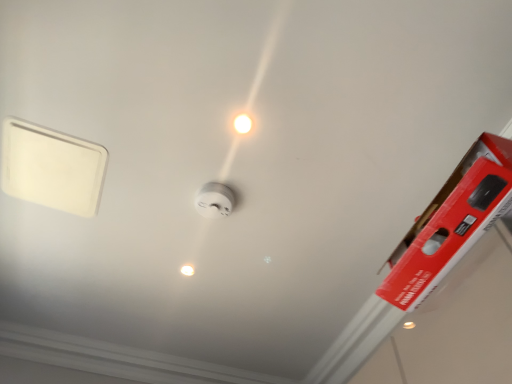
In order to face white glossy light bulb at center, acting as the first light bulb starting from the front, should I rotate leftwards or rightwards?

It's best to rotate left around 1.644 degrees.

Measure the distance between point (219, 196) and camera.

The distance of point (219, 196) from camera is 1.53 meters.

You are a GUI agent. You are given a task and a screenshot of the screen. Output one action in this format:
    pyautogui.click(x=<x>, y=<y>)
    Task: Click on the white glossy light bulb at center, which is the second light bulb from right to left
    This screenshot has width=512, height=384.
    Given the screenshot: What is the action you would take?
    pyautogui.click(x=187, y=270)

I want to click on white glossy light bulb at center, the first light bulb from the right, so click(242, 124).

From a real-world perspective, is white glossy light bulb at center, the first light bulb from the right, located higher than white plastic smoke detector at center?

Yes, from a real-world perspective, white glossy light bulb at center, the first light bulb from the right, is on top of white plastic smoke detector at center.

Is white glossy light bulb at center, marked as the second light bulb in a bottom-to-top arrangement, positioned with its back to white plastic smoke detector at center?

Yes, white glossy light bulb at center, marked as the second light bulb in a bottom-to-top arrangement, is positioned with its back facing white plastic smoke detector at center.

In the image, is white glossy light bulb at center, the second light bulb viewed from the back, positioned in front of or behind white plastic smoke detector at center?

white glossy light bulb at center, the second light bulb viewed from the back, is in front of white plastic smoke detector at center.

Based on the photo, between white glossy light bulb at center, marked as the second light bulb in a bottom-to-top arrangement, and white plastic smoke detector at center, which one has less height?

white glossy light bulb at center, marked as the second light bulb in a bottom-to-top arrangement, is shorter.

How many degrees apart are the facing directions of white glossy light bulb at center, acting as the second light bulb starting from the front, and white plastic smoke detector at center?

There is a 9.07-degree angle between the facing directions of white glossy light bulb at center, acting as the second light bulb starting from the front, and white plastic smoke detector at center.

From a real-world perspective, is white glossy light bulb at center, which is counted as the 1th light bulb, starting from the bottom, physically located above or below white plastic smoke detector at center?

From a real-world perspective, white glossy light bulb at center, which is counted as the 1th light bulb, starting from the bottom, is physically above white plastic smoke detector at center.

Is white glossy light bulb at center, which is the second light bulb from right to left, completely or partially outside of white plastic smoke detector at center?

That's correct, white glossy light bulb at center, which is the second light bulb from right to left, is outside of white plastic smoke detector at center.

Can you confirm if white glossy light bulb at center, placed as the first light bulb when sorted from left to right, is wider than white plastic smoke detector at center?

Incorrect, the width of white glossy light bulb at center, placed as the first light bulb when sorted from left to right, does not surpass that of white plastic smoke detector at center.

Which is behind, point (185, 268) or point (246, 119)?

The point (185, 268) is farther from the camera.

From a real-world perspective, is white glossy light bulb at center, acting as the second light bulb starting from the front, over white glossy light bulb at center, the second light bulb viewed from the back?

No, from a real-world perspective, white glossy light bulb at center, acting as the second light bulb starting from the front, is not over white glossy light bulb at center, the second light bulb viewed from the back

Is white glossy light bulb at center, acting as the second light bulb starting from the front, placed right next to white glossy light bulb at center, acting as the first light bulb starting from the front?

No, white glossy light bulb at center, acting as the second light bulb starting from the front, is not with white glossy light bulb at center, acting as the first light bulb starting from the front.

Where is `light bulb below the white glossy light bulb at center, the first light bulb from the right (from the image's perspective)`? The width and height of the screenshot is (512, 384). light bulb below the white glossy light bulb at center, the first light bulb from the right (from the image's perspective) is located at coordinates (187, 270).

Between white glossy light bulb at center, the first light bulb from the right, and white glossy light bulb at center, which is the second light bulb from right to left, which one has more height?

Standing taller between the two is white glossy light bulb at center, the first light bulb from the right.

Which point is more distant from viewer, (241, 129) or (181, 269)?

Positioned behind is point (181, 269).

Is the depth of white glossy light bulb at center, acting as the first light bulb starting from the front, greater than that of white glossy light bulb at center, which is the second light bulb from right to left?

No, white glossy light bulb at center, acting as the first light bulb starting from the front, is closer to the viewer.

Between white glossy light bulb at center, placed as the 2th light bulb when sorted from left to right, and white glossy light bulb at center, acting as the second light bulb starting from the front, which one has larger width?

white glossy light bulb at center, placed as the 2th light bulb when sorted from left to right.

How many degrees apart are the facing directions of white plastic smoke detector at center and white glossy light bulb at center, placed as the 2th light bulb when sorted from left to right?

The angle between the facing direction of white plastic smoke detector at center and the facing direction of white glossy light bulb at center, placed as the 2th light bulb when sorted from left to right, is 3.74 degrees.

Which object is further away from the camera, white plastic smoke detector at center or white glossy light bulb at center, the 1th light bulb viewed from the top?

white plastic smoke detector at center is further from the camera.

From a real-world perspective, who is located higher, white plastic smoke detector at center or white glossy light bulb at center, the first light bulb from the right?

white glossy light bulb at center, the first light bulb from the right, is physically above.

From the image's perspective, would you say white plastic smoke detector at center is positioned over white glossy light bulb at center, the first light bulb from the right?

Actually, white plastic smoke detector at center appears below white glossy light bulb at center, the first light bulb from the right, in the image.

Considering the positions of objects white plastic smoke detector at center and white glossy light bulb at center, which is the second light bulb from right to left, in the image provided, who is more to the right, white plastic smoke detector at center or white glossy light bulb at center, which is the second light bulb from right to left,?

Positioned to the right is white plastic smoke detector at center.

Is point (204, 215) positioned after point (184, 267)?

No, it is in front of (184, 267).

Considering the sizes of objects white plastic smoke detector at center and white glossy light bulb at center, which is the second light bulb from right to left, in the image provided, who is wider, white plastic smoke detector at center or white glossy light bulb at center, which is the second light bulb from right to left,?

With larger width is white plastic smoke detector at center.

From the image's perspective, is white plastic smoke detector at center above or below white glossy light bulb at center, which is the second light bulb from right to left?

Clearly, from the image's perspective, white plastic smoke detector at center is above white glossy light bulb at center, which is the second light bulb from right to left.

The image size is (512, 384). What are the coordinates of `power plugs and sockets that is on the left side of white glossy light bulb at center, placed as the 2th light bulb when sorted from left to right` in the screenshot? It's located at (214, 200).

This screenshot has height=384, width=512. What are the coordinates of `power plugs and sockets in front of the white glossy light bulb at center, which is the second light bulb from right to left` in the screenshot? It's located at (214, 200).

Estimate the real-world distances between objects in this image. Which object is closer to white plastic smoke detector at center, white glossy light bulb at center, acting as the first light bulb starting from the front, or white glossy light bulb at center, placed as the first light bulb when sorted from left to right?

Among the two, white glossy light bulb at center, acting as the first light bulb starting from the front, is located nearer to white plastic smoke detector at center.

When comparing their distances from white plastic smoke detector at center, does white glossy light bulb at center, which is counted as the 1th light bulb, starting from the bottom, or white glossy light bulb at center, marked as the second light bulb in a bottom-to-top arrangement, seem closer?

Based on the image, white glossy light bulb at center, marked as the second light bulb in a bottom-to-top arrangement, appears to be nearer to white plastic smoke detector at center.

Looking at the image, which one is located further to white glossy light bulb at center, marked as the second light bulb in a bottom-to-top arrangement, white plastic smoke detector at center or white glossy light bulb at center, which is the second light bulb from right to left?

white glossy light bulb at center, which is the second light bulb from right to left, lies further to white glossy light bulb at center, marked as the second light bulb in a bottom-to-top arrangement, than the other object.

When comparing their distances from white glossy light bulb at center, marked as the second light bulb in a bottom-to-top arrangement, does white glossy light bulb at center, placed as the first light bulb when sorted from left to right, or white plastic smoke detector at center seem closer?

Among the two, white plastic smoke detector at center is located nearer to white glossy light bulb at center, marked as the second light bulb in a bottom-to-top arrangement.

Based on their spatial positions, is white plastic smoke detector at center or white glossy light bulb at center, the 1th light bulb viewed from the top, further from white glossy light bulb at center, which is the second light bulb from right to left?

white glossy light bulb at center, the 1th light bulb viewed from the top, is further to white glossy light bulb at center, which is the second light bulb from right to left.

Estimate the real-world distances between objects in this image. Which object is closer to white glossy light bulb at center, placed as the first light bulb when sorted from left to right, white glossy light bulb at center, acting as the first light bulb starting from the front, or white plastic smoke detector at center?

Based on the image, white plastic smoke detector at center appears to be nearer to white glossy light bulb at center, placed as the first light bulb when sorted from left to right.

At what (x,y) coordinates should I click in order to perform the action: click on power plugs and sockets between white glossy light bulb at center, acting as the first light bulb starting from the front, and white glossy light bulb at center, which is the second light bulb from right to left, in the up-down direction. Please return your answer as a coordinate pair (x, y). Looking at the image, I should click on (214, 200).